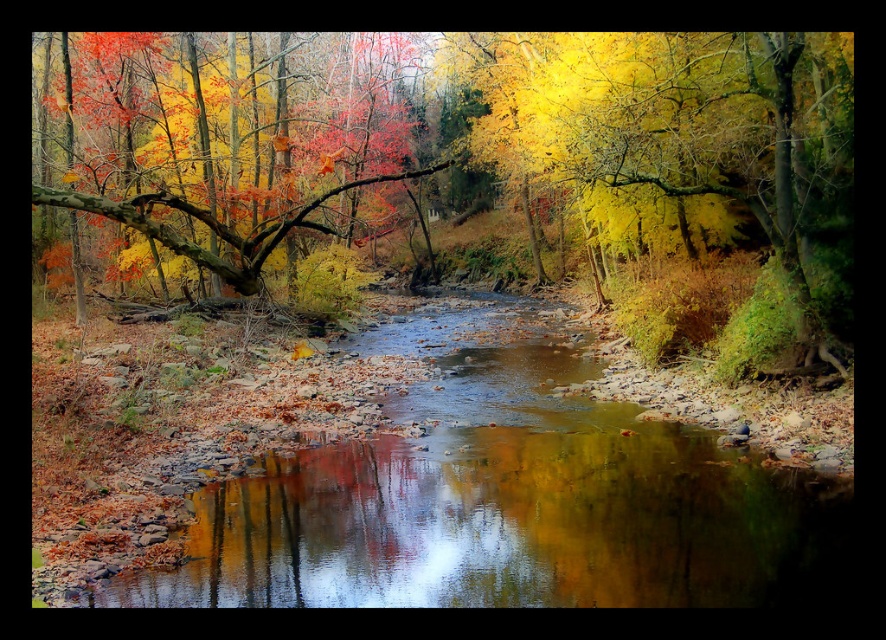
Does matte brown tree trunk at center appear under shiny reflective water at center?

Incorrect, matte brown tree trunk at center is not positioned below shiny reflective water at center.

Identify the location of matte brown tree trunk at center. This screenshot has width=886, height=640. click(492, 141).

Can you confirm if matte brown tree trunk at center is positioned to the right of smooth brown branch at upper left?

Indeed, matte brown tree trunk at center is positioned on the right side of smooth brown branch at upper left.

Can you confirm if matte brown tree trunk at center is positioned to the left of smooth brown branch at upper left?

No, matte brown tree trunk at center is not to the left of smooth brown branch at upper left.

Which is behind, point (236, 228) or point (185, 241)?

The point (236, 228) is more distant.

Locate an element on the screen. matte brown tree trunk at center is located at coordinates [x=492, y=141].

Which is behind, point (408, 156) or point (828, 172)?

Positioned behind is point (408, 156).

Who is more forward, (562, 90) or (756, 188)?

Positioned in front is point (756, 188).

The height and width of the screenshot is (640, 886). What are the coordinates of `matte brown tree trunk at center` in the screenshot? It's located at (492, 141).